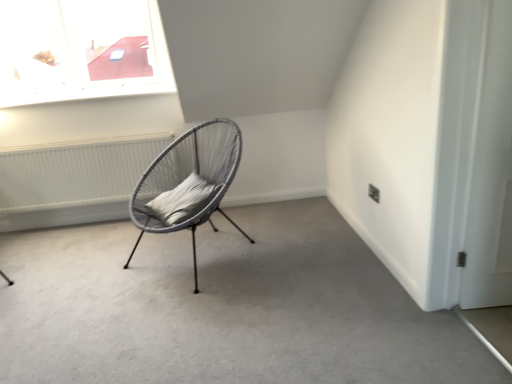
Find the location of a particular element. The image size is (512, 384). vacant area that is situated to the right of matte grey wicker chair at center is located at coordinates (298, 249).